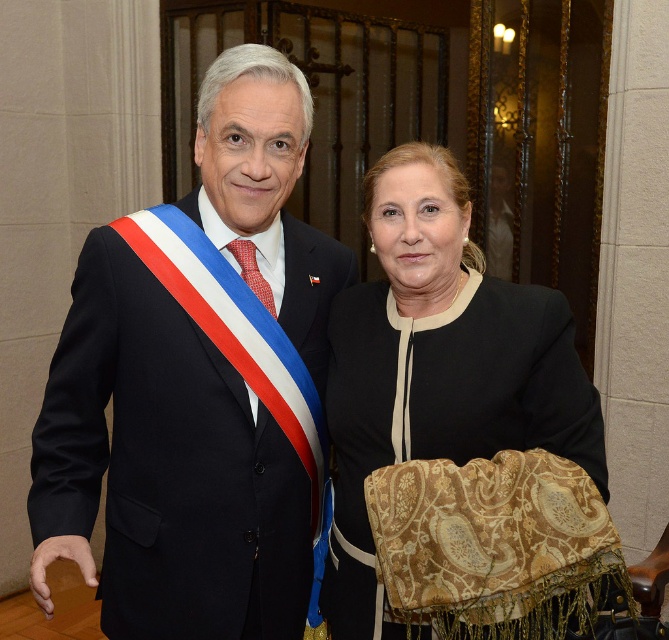
Question: Where is matte black suit at left located in relation to matte black jacket at center in the image?

Choices:
 (A) below
 (B) above

Answer: (B)

Question: Which of the following is the closest to the observer?

Choices:
 (A) matte black suit at left
 (B) matte black jacket at center

Answer: (A)

Question: Among these objects, which one is farthest from the camera?

Choices:
 (A) matte black jacket at center
 (B) matte black suit at left

Answer: (A)

Question: Does matte black suit at left have a larger size compared to matte black jacket at center?

Choices:
 (A) yes
 (B) no

Answer: (B)

Question: Does matte black suit at left appear on the right side of matte black jacket at center?

Choices:
 (A) yes
 (B) no

Answer: (B)